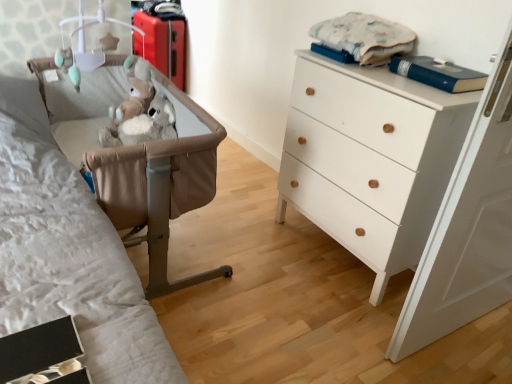
Locate an element on the screen. Image resolution: width=512 pixels, height=384 pixels. free point in front of white wood chest of drawers at right is located at coordinates (333, 325).